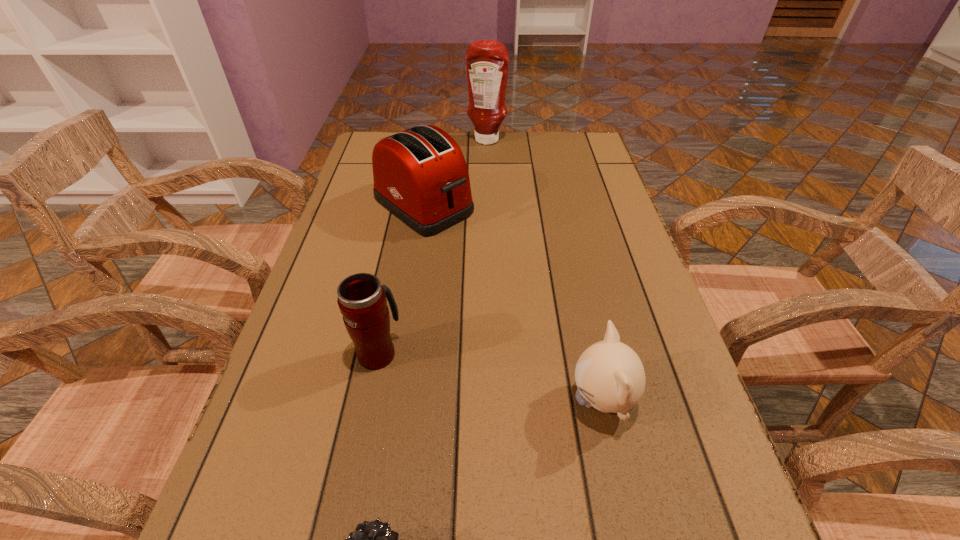
At what (x,y) coordinates should I click in order to perform the action: click on vacant space that satisfies the following two spatial constraints: 1. on the back side of the second farthest object; 2. on the right side of the tallest object. Please return your answer as a coordinate pair (x, y). Looking at the image, I should click on (434, 140).

In order to click on free space that satisfies the following two spatial constraints: 1. on the back side of the toaster; 2. on the right side of the farthest object in this screenshot , I will do `click(434, 140)`.